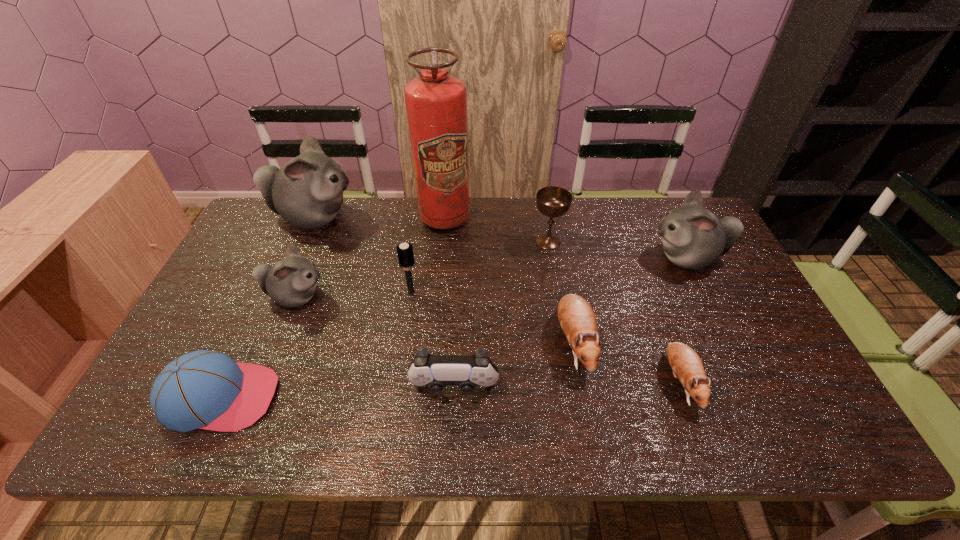
You are a GUI agent. You are given a task and a screenshot of the screen. Output one action in this format:
    pyautogui.click(x=<x>, y=<y>)
    Task: Click on the control
    Image resolution: width=960 pixels, height=540 pixels.
    Given the screenshot: What is the action you would take?
    pyautogui.click(x=437, y=371)

Where is `the bigger brown hamster`? The width and height of the screenshot is (960, 540). the bigger brown hamster is located at coordinates (577, 319).

The height and width of the screenshot is (540, 960). Identify the location of the third hamster from right to left. (577, 319).

Where is `baseball cap`? This screenshot has height=540, width=960. baseball cap is located at coordinates (203, 389).

The width and height of the screenshot is (960, 540). What are the coordinates of `the smaller brown hamster` in the screenshot? It's located at (686, 365).

What are the coordinates of `the second hamster from right to left` in the screenshot? It's located at (686, 365).

Locate an element on the screen. This screenshot has height=540, width=960. free spot located 0.130m on the label side of the tallest object is located at coordinates (441, 260).

The image size is (960, 540). I want to click on free space located 0.270m on the face of the second tallest object, so click(436, 218).

You are a GUI agent. You are given a task and a screenshot of the screen. Output one action in this format:
    pyautogui.click(x=<x>, y=<y>)
    Task: Click on the vacant space situated on the face of the eighth shortest object
    The width and height of the screenshot is (960, 540).
    Given the screenshot: What is the action you would take?
    pyautogui.click(x=574, y=258)

The image size is (960, 540). Find the location of `vacant region located 0.390m on the face of the eighth shortest object`. vacant region located 0.390m on the face of the eighth shortest object is located at coordinates (522, 258).